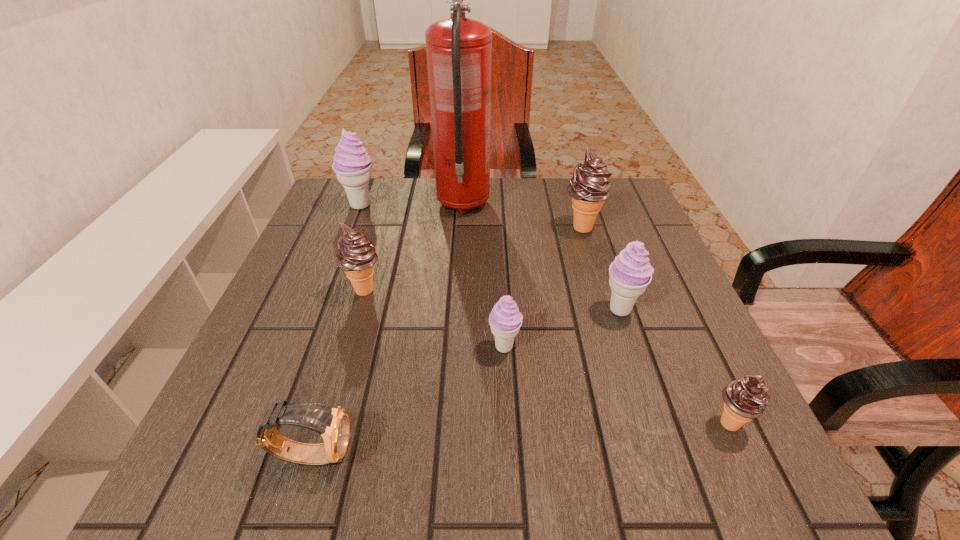
In order to click on fire extinguisher in this screenshot , I will do `click(459, 50)`.

Where is `red fire extinguisher`? The width and height of the screenshot is (960, 540). red fire extinguisher is located at coordinates (459, 50).

I want to click on the farthest chocolate icecream, so click(589, 187).

Image resolution: width=960 pixels, height=540 pixels. I want to click on the second farthest icecream, so click(x=589, y=187).

You are a GUI agent. You are given a task and a screenshot of the screen. Output one action in this format:
    pyautogui.click(x=<x>, y=<y>)
    Task: Click on the farthest icecream
    Image resolution: width=960 pixels, height=540 pixels.
    Given the screenshot: What is the action you would take?
    (352, 165)

Locate an element on the screen. The image size is (960, 540). the farthest purple icecream is located at coordinates (352, 165).

Find the location of `the second farthest chocolate icecream`. the second farthest chocolate icecream is located at coordinates (356, 256).

Where is `the second biggest chocolate icecream`? The image size is (960, 540). the second biggest chocolate icecream is located at coordinates (356, 256).

What are the coordinates of `the rightmost purple icecream` in the screenshot? It's located at (630, 273).

Locate an element on the screen. The image size is (960, 540). the second smallest purple icecream is located at coordinates (630, 273).